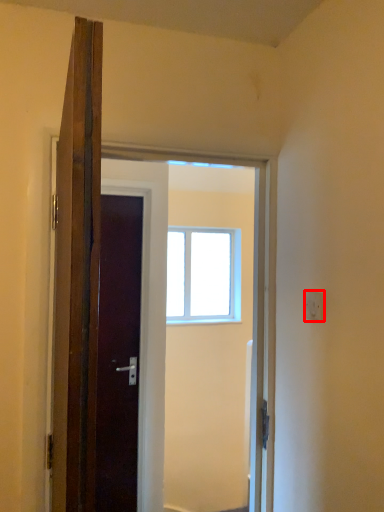
Question: From the image, what is the correct spatial relationship of electric outlet (annotated by the red box) in relation to window?

Choices:
 (A) right
 (B) left

Answer: (A)